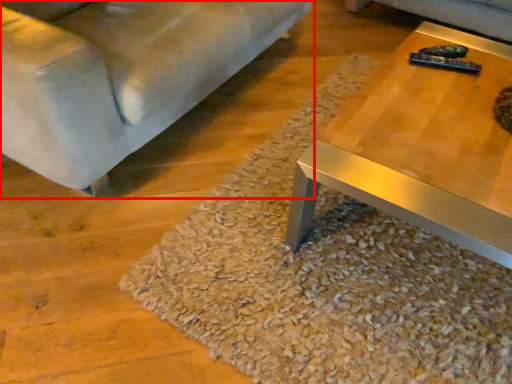
Question: From the image's perspective, considering the relative positions of studio couch (annotated by the red box) and gravel in the image provided, where is studio couch (annotated by the red box) located with respect to the staircase?

Choices:
 (A) below
 (B) above

Answer: (B)